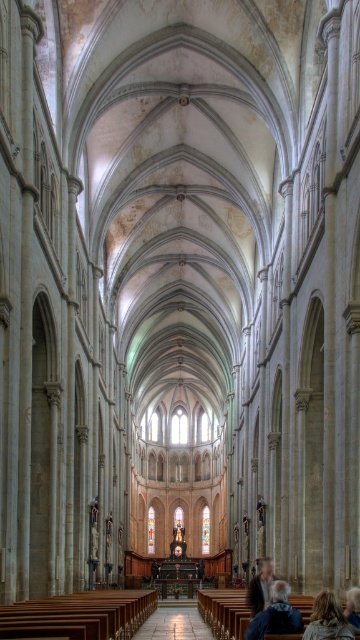
Question: Which object appears farthest from the camera in this image?

Choices:
 (A) blonde hair at lower right
 (B) gray hair at center

Answer: (B)

Question: Does blue denim jacket at lower right come in front of blonde hair at lower right?

Choices:
 (A) no
 (B) yes

Answer: (A)

Question: Estimate the real-world distances between objects in this image. Which object is farther from the blonde hair at lower right?

Choices:
 (A) gray hair at center
 (B) blue denim jacket at lower right

Answer: (A)

Question: Which object appears closest to the camera in this image?

Choices:
 (A) blue denim jacket at lower right
 (B) gray hair at center

Answer: (A)

Question: Is blue denim jacket at lower right closer to camera compared to dark brown leather jacket at lower center?

Choices:
 (A) yes
 (B) no

Answer: (A)

Question: Is blue denim jacket at lower right below gray hair at center?

Choices:
 (A) no
 (B) yes

Answer: (B)